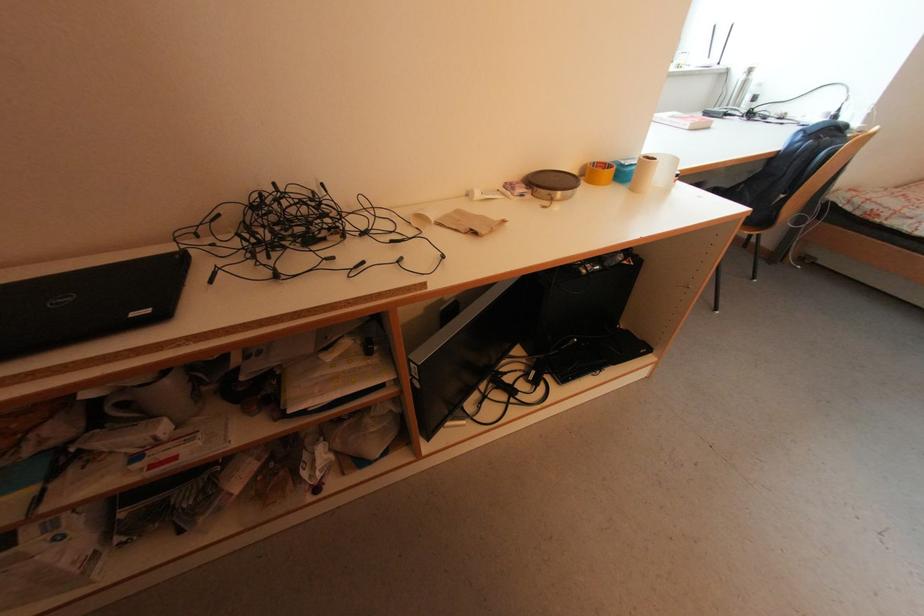
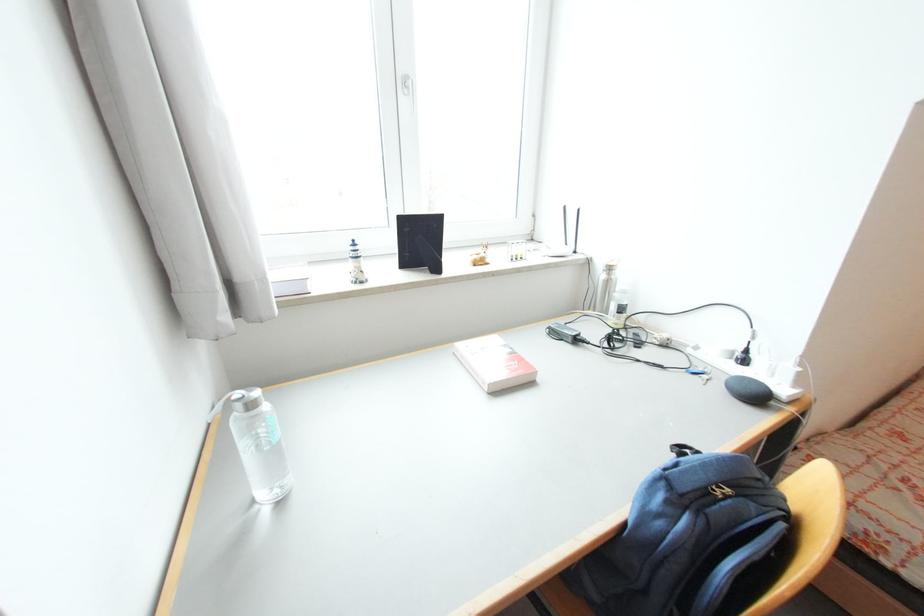
What movement of the cameraman would produce the second image?

The cameraman moved toward right, forward.